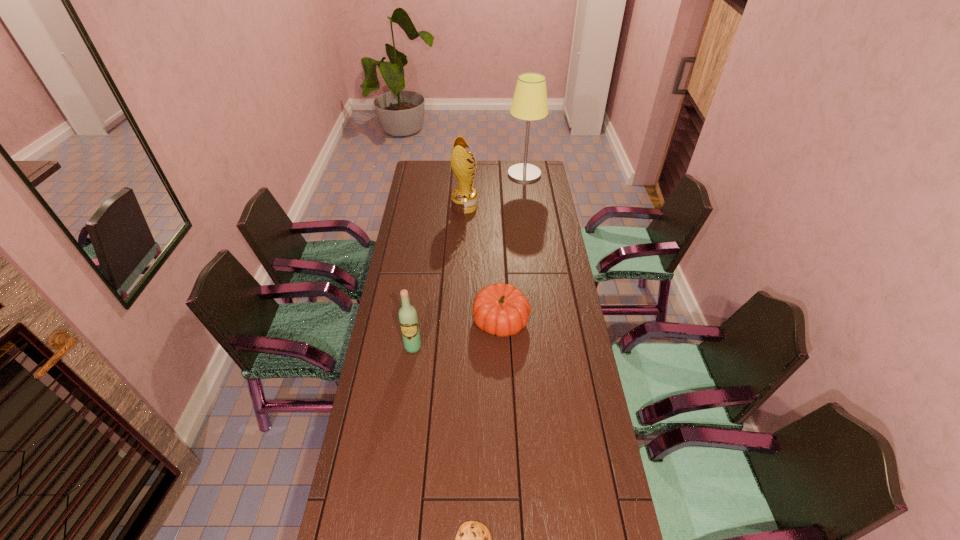
Locate an element on the screen. This screenshot has height=540, width=960. vacant space located on the front of the pumpkin is located at coordinates (507, 441).

This screenshot has width=960, height=540. I want to click on object that is at the far edge, so click(x=529, y=103).

What are the coordinates of `object at the left edge` in the screenshot? It's located at (408, 319).

Identify the location of object located at the right edge. (529, 103).

Where is `object that is at the far right corner`? object that is at the far right corner is located at coordinates (529, 103).

In the image, there is a desktop. At what (x,y) coordinates should I click in order to perform the action: click on vacant region at the left edge. Please return your answer as a coordinate pair (x, y). The height and width of the screenshot is (540, 960). Looking at the image, I should click on (420, 280).

In the image, there is a desktop. In order to click on vacant region at the right edge in this screenshot , I will do `click(527, 242)`.

The width and height of the screenshot is (960, 540). I want to click on free space between the table lamp and the second shortest object, so (x=513, y=247).

Image resolution: width=960 pixels, height=540 pixels. I want to click on vacant area that lies between the third tallest object and the fourth shortest object, so click(x=439, y=276).

Locate an element on the screen. The image size is (960, 540). vacant area between the fourth tallest object and the leftmost object is located at coordinates (457, 334).